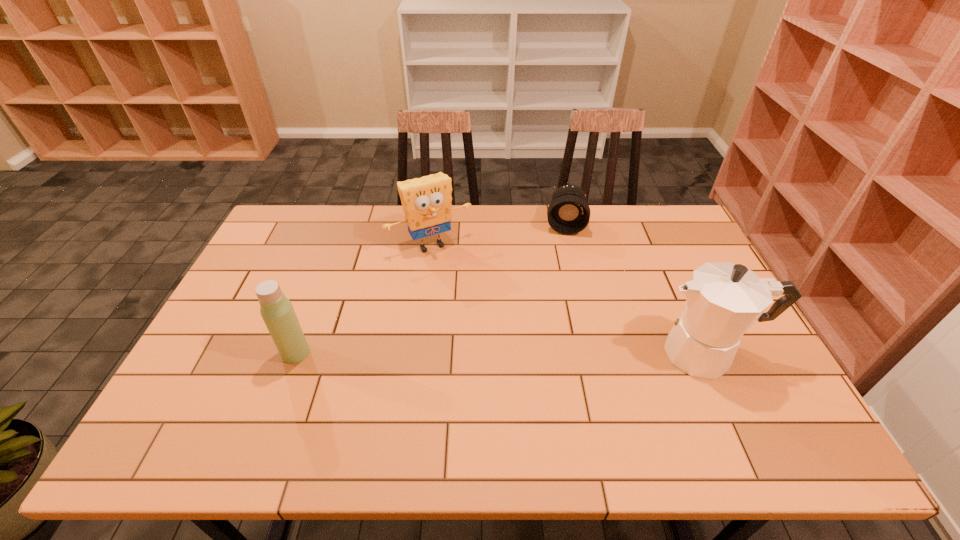
At what (x,y) coordinates should I click in order to perform the action: click on free region at the near edge of the desktop. Please return your answer as a coordinate pair (x, y). The width and height of the screenshot is (960, 540). Looking at the image, I should click on (247, 412).

Where is `blank space at the left edge of the desktop`? This screenshot has width=960, height=540. blank space at the left edge of the desktop is located at coordinates (220, 335).

Find the location of a particular element. Image resolution: width=960 pixels, height=540 pixels. blank space at the far right corner is located at coordinates (666, 233).

You are a GUI agent. You are given a task and a screenshot of the screen. Output one action in this format:
    pyautogui.click(x=<x>, y=<y>)
    Task: Click on the unoccupied area between the third object from left to right and the tallest object
    
    Given the screenshot: What is the action you would take?
    pyautogui.click(x=636, y=289)

Find the location of `empty space between the thermos bottle and the telephoto lens`. empty space between the thermos bottle and the telephoto lens is located at coordinates (430, 289).

You are a GUI agent. You are given a task and a screenshot of the screen. Output one action in this format:
    pyautogui.click(x=<x>, y=<y>)
    Task: Click on the free spot between the leftmost object and the second object from left to right
    
    Given the screenshot: What is the action you would take?
    pyautogui.click(x=364, y=299)

The image size is (960, 540). Identify the location of blank region between the thermos bottle and the second object from left to right. (364, 299).

You are a GUI agent. You are given a task and a screenshot of the screen. Output one action in this format:
    pyautogui.click(x=<x>, y=<y>)
    Task: Click on the free space between the tallest object and the second object from left to right
    The width and height of the screenshot is (960, 540).
    Given the screenshot: What is the action you would take?
    pyautogui.click(x=569, y=299)

I want to click on vacant space in between the second object from right to left and the third object from right to left, so pyautogui.click(x=498, y=235).

I want to click on free space between the sponge and the coffeepot, so click(x=569, y=299).